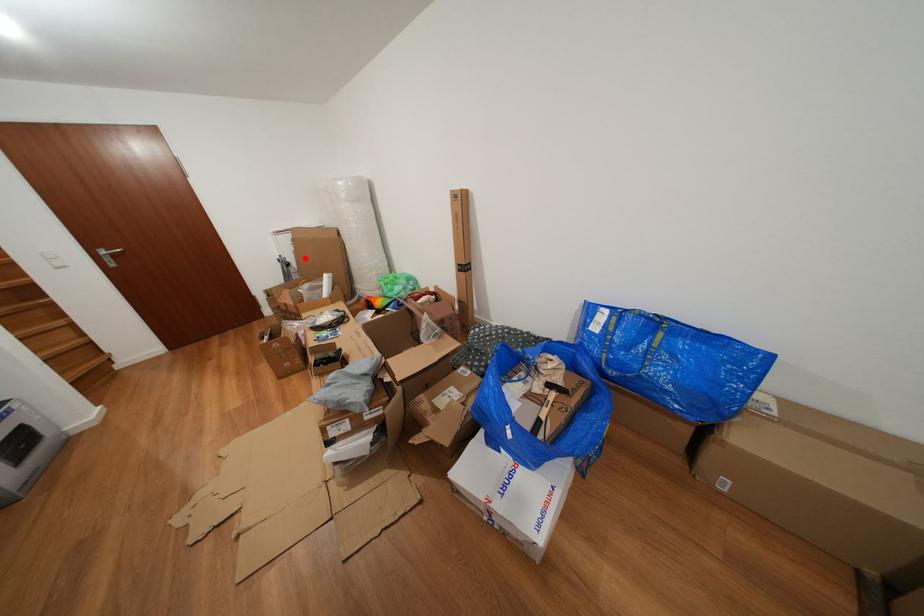
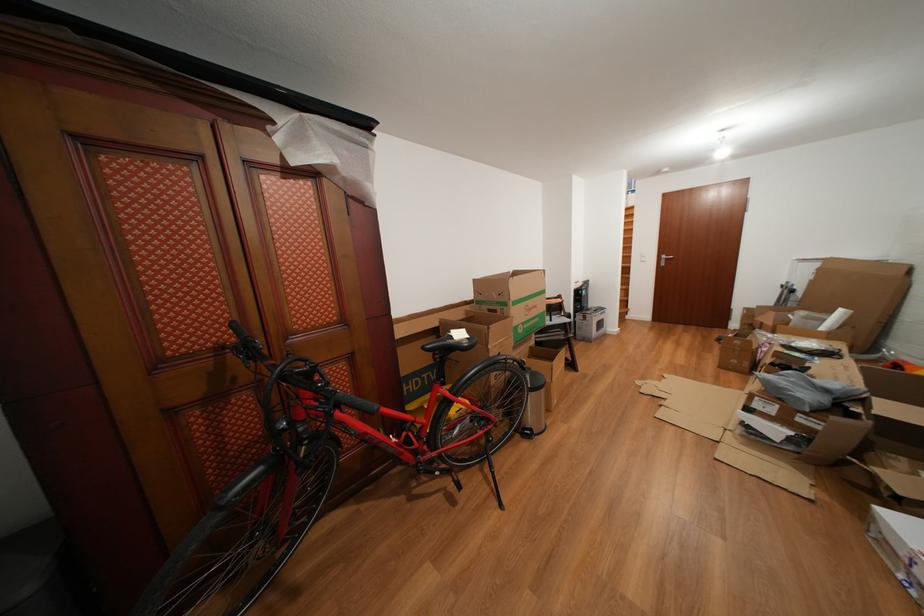
Find the pixel in the second image that matches the highlighted location in the first image.

(821, 288)